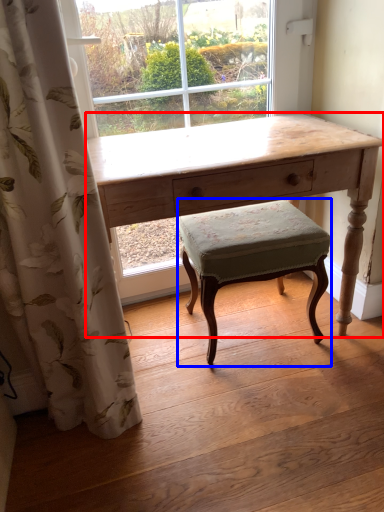
Question: Which object appears closest to the camera in this image, desk (highlighted by a red box) or stool (highlighted by a blue box)?

Choices:
 (A) desk
 (B) stool

Answer: (A)